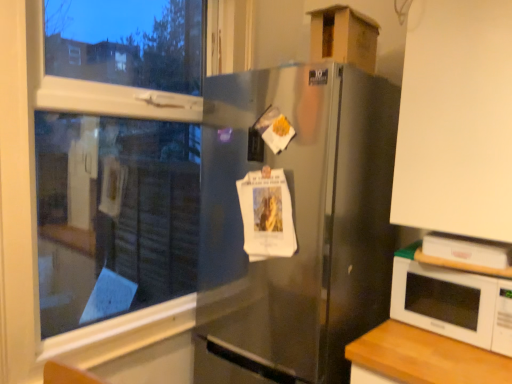
Question: From a real-world perspective, is cardboard box at upper right below white matte cabinet at upper right?

Choices:
 (A) yes
 (B) no

Answer: (B)

Question: Is cardboard box at upper right taller than white matte cabinet at upper right?

Choices:
 (A) yes
 (B) no

Answer: (B)

Question: From the image's perspective, does cardboard box at upper right appear lower than white matte cabinet at upper right?

Choices:
 (A) no
 (B) yes

Answer: (A)

Question: Does cardboard box at upper right have a smaller size compared to white matte cabinet at upper right?

Choices:
 (A) yes
 (B) no

Answer: (A)

Question: Is the position of cardboard box at upper right less distant than that of white matte cabinet at upper right?

Choices:
 (A) no
 (B) yes

Answer: (A)

Question: Is satin silver refrigerator at center wider or thinner than white matte cabinet at upper right?

Choices:
 (A) thin
 (B) wide

Answer: (B)

Question: Considering the positions of point tap(287, 380) and point tap(508, 183), is point tap(287, 380) closer or farther from the camera than point tap(508, 183)?

Choices:
 (A) farther
 (B) closer

Answer: (A)

Question: From the image's perspective, is satin silver refrigerator at center above or below white matte cabinet at upper right?

Choices:
 (A) above
 (B) below

Answer: (B)

Question: From their relative heights in the image, would you say satin silver refrigerator at center is taller or shorter than white matte cabinet at upper right?

Choices:
 (A) tall
 (B) short

Answer: (A)

Question: Is point (474, 337) positioned closer to the camera than point (505, 215)?

Choices:
 (A) farther
 (B) closer

Answer: (A)

Question: From a real-world perspective, is white glossy microwave at lower right positioned above or below white matte cabinet at upper right?

Choices:
 (A) below
 (B) above

Answer: (A)

Question: Based on their positions, is white glossy microwave at lower right located to the left or right of white matte cabinet at upper right?

Choices:
 (A) right
 (B) left

Answer: (B)

Question: Is white glossy microwave at lower right taller or shorter than white matte cabinet at upper right?

Choices:
 (A) tall
 (B) short

Answer: (B)

Question: Considering their positions, is satin silver refrigerator at center located in front of or behind transparent glass window at upper left?

Choices:
 (A) front
 (B) behind

Answer: (B)

Question: Considering the positions of satin silver refrigerator at center and transparent glass window at upper left in the image, is satin silver refrigerator at center bigger or smaller than transparent glass window at upper left?

Choices:
 (A) small
 (B) big

Answer: (B)